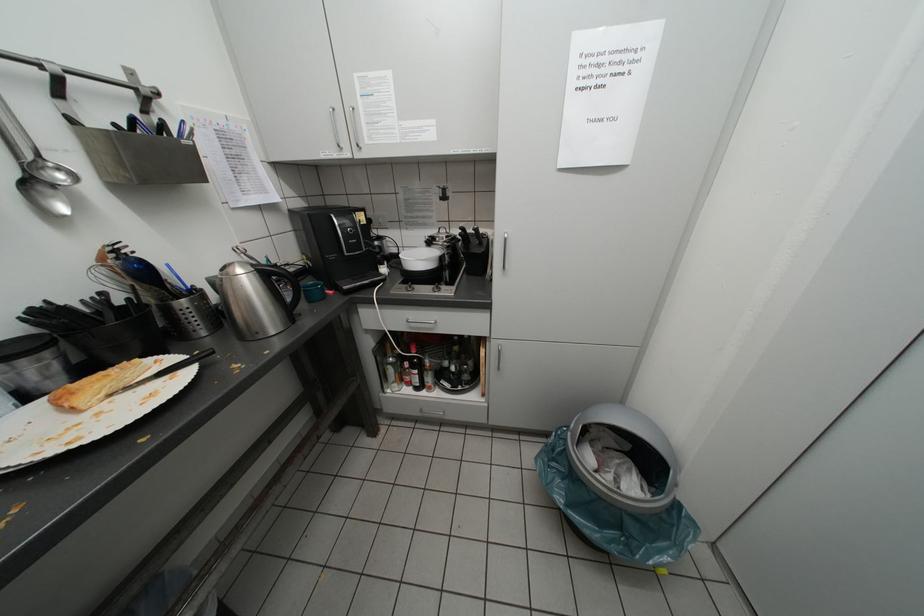
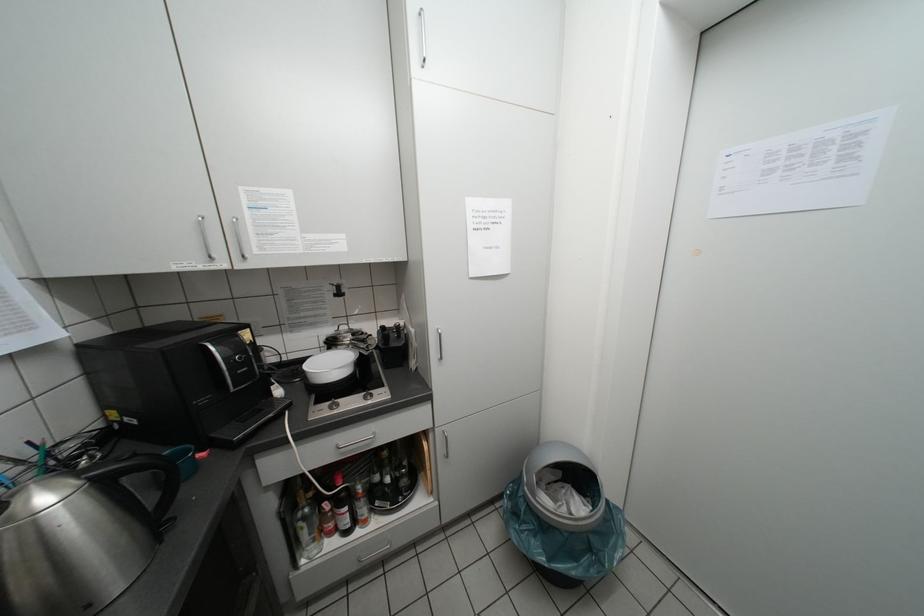
Question: The camera is either moving clockwise (left) or counter-clockwise (right) around the object. The first image is from the beginning of the video and the second image is from the end. Is the camera moving left or right when shooting the video?

Choices:
 (A) Left
 (B) Right

Answer: (A)